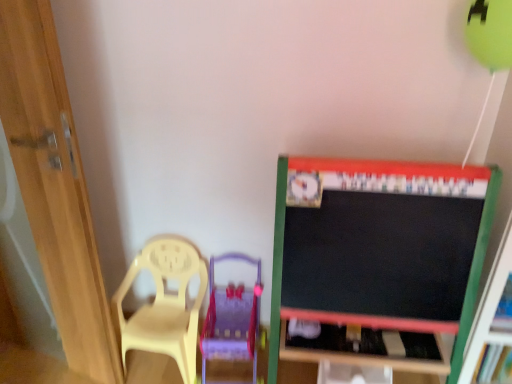
Question: Is yellow plastic chair at left closer to the viewer compared to wooden door at left?

Choices:
 (A) yes
 (B) no

Answer: (B)

Question: Does yellow plastic chair at left appear on the right side of wooden door at left?

Choices:
 (A) yes
 (B) no

Answer: (A)

Question: From the image's perspective, is yellow plastic chair at left located beneath wooden door at left?

Choices:
 (A) no
 (B) yes

Answer: (B)

Question: Does yellow plastic chair at left have a greater height compared to wooden door at left?

Choices:
 (A) yes
 (B) no

Answer: (B)

Question: Is yellow plastic chair at left outside wooden door at left?

Choices:
 (A) yes
 (B) no

Answer: (A)

Question: Does yellow plastic chair at left lie behind wooden door at left?

Choices:
 (A) no
 (B) yes

Answer: (B)

Question: Does wooden door at left have a greater width compared to translucent yellow swivel chair at lower left?

Choices:
 (A) no
 (B) yes

Answer: (A)

Question: Is wooden door at left positioned far away from translucent yellow swivel chair at lower left?

Choices:
 (A) no
 (B) yes

Answer: (A)

Question: From the image's perspective, does wooden door at left appear lower than translucent yellow swivel chair at lower left?

Choices:
 (A) yes
 (B) no

Answer: (B)

Question: Is wooden door at left placed right next to translucent yellow swivel chair at lower left?

Choices:
 (A) no
 (B) yes

Answer: (A)

Question: Does wooden door at left appear on the right side of translucent yellow swivel chair at lower left?

Choices:
 (A) yes
 (B) no

Answer: (B)

Question: From the image's perspective, does wooden door at left appear higher than translucent yellow swivel chair at lower left?

Choices:
 (A) yes
 (B) no

Answer: (A)

Question: Considering the relative positions of yellow plastic chair at left and wooden table at lower center in the image provided, is yellow plastic chair at left behind wooden table at lower center?

Choices:
 (A) yes
 (B) no

Answer: (B)